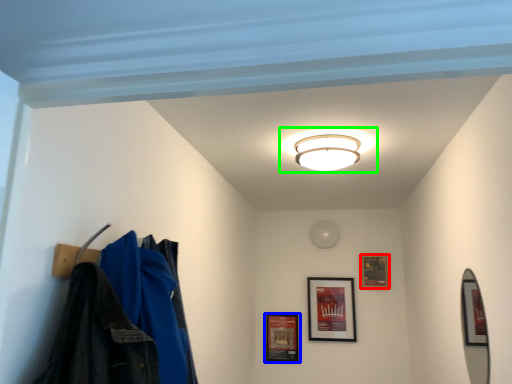
Question: Based on their relative distances, which object is nearer to picture frame (highlighted by a red box)? Choose from picture frame (highlighted by a blue box) and lamp (highlighted by a green box).

Choices:
 (A) picture frame
 (B) lamp

Answer: (A)